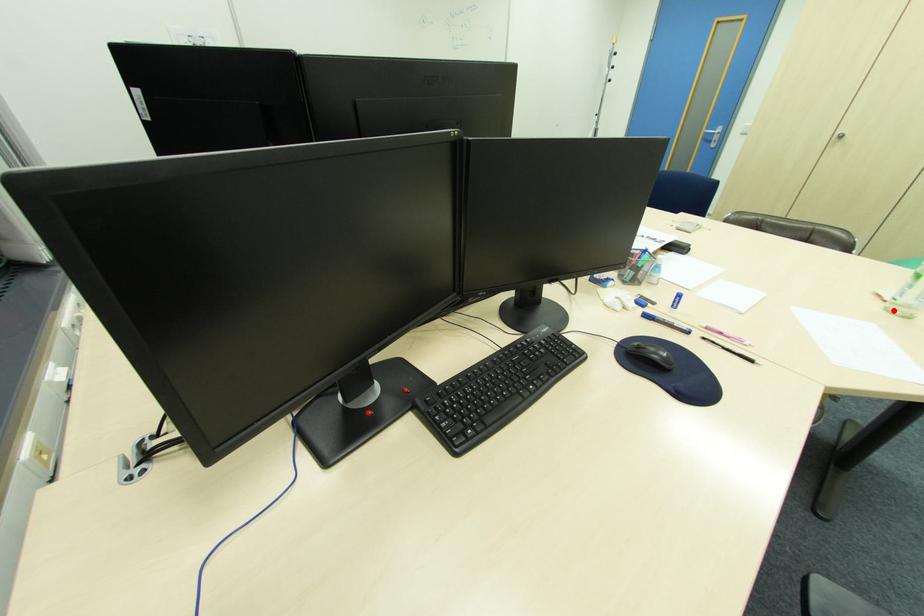
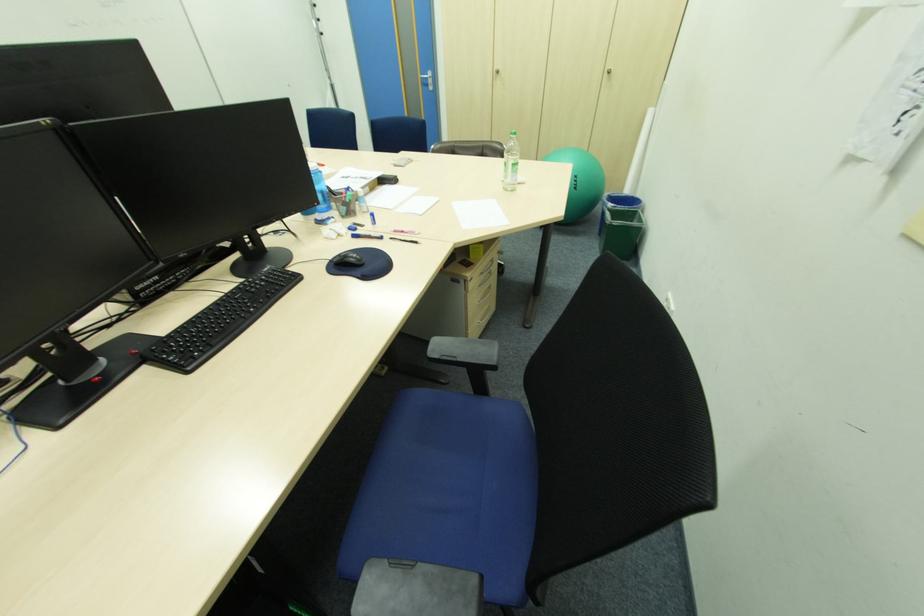
Find the pixel in the second image that matches the highlighted location in the first image.

(511, 190)